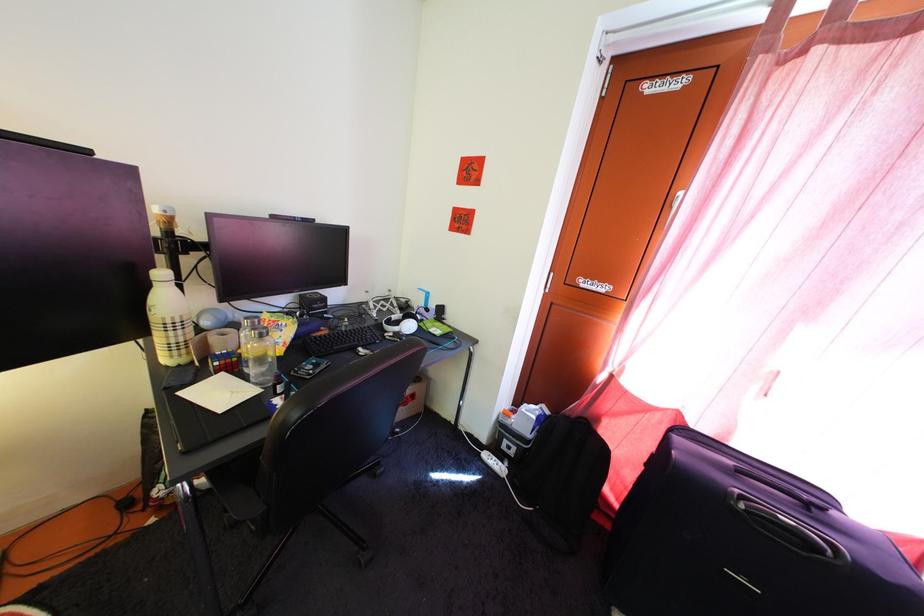
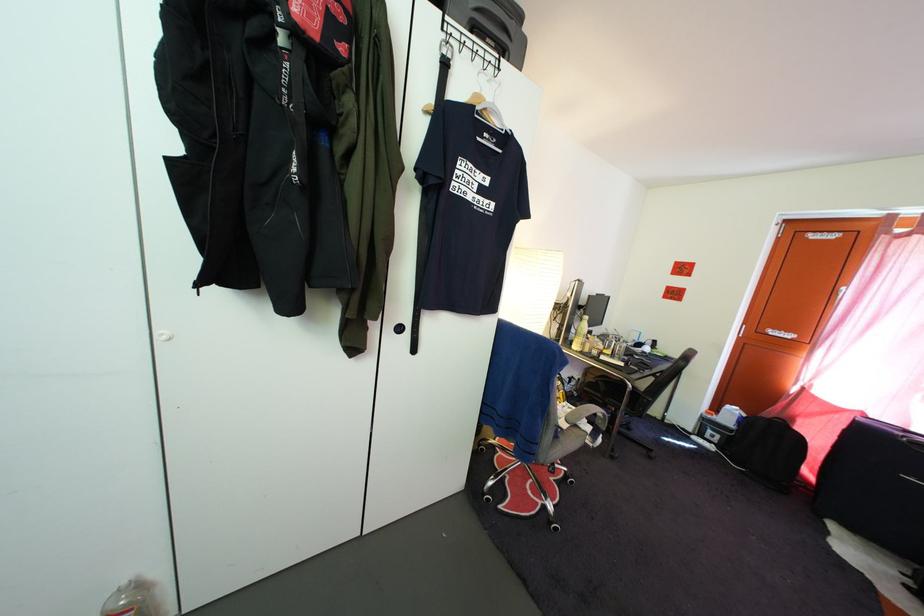
Find the pixel in the second image that matches (x=517, y=456) in the first image.

(721, 445)